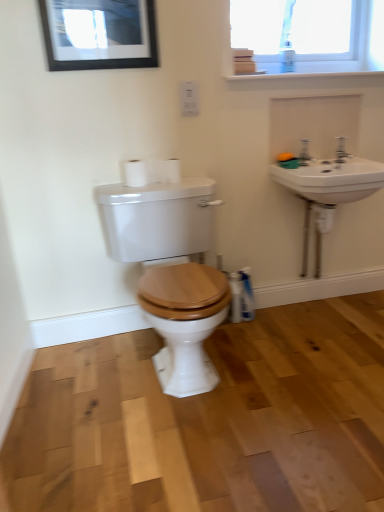
Find the location of a particular element. The width and height of the screenshot is (384, 512). free space to the right of orange matte soap at upper right is located at coordinates (309, 161).